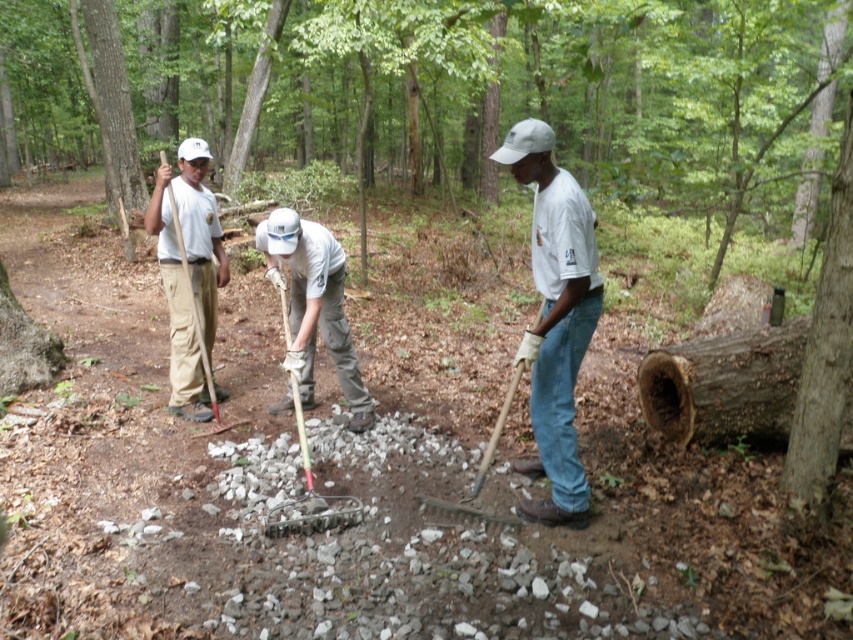
Question: Which object appears closest to the camera in this image?

Choices:
 (A) wooden handle shovel at center
 (B) white matte shirt at center

Answer: (B)

Question: Which object appears farthest from the camera in this image?

Choices:
 (A) smooth brown tree trunk at upper left
 (B) white cotton shirt at center
 (C) wooden handle shovel at center

Answer: (A)

Question: Among these points, which one is nearest to the camera?

Choices:
 (A) (338, 372)
 (B) (107, 189)

Answer: (A)

Question: Is smooth brown tree trunk at upper left below wooden handle shovel at center?

Choices:
 (A) yes
 (B) no

Answer: (B)

Question: Is white cotton shirt at center to the left of wooden handle shovel at center from the viewer's perspective?

Choices:
 (A) yes
 (B) no

Answer: (B)

Question: Considering the relative positions of white cotton shirt at center and wooden handle shovel at center in the image provided, where is white cotton shirt at center located with respect to wooden handle shovel at center?

Choices:
 (A) right
 (B) left

Answer: (A)